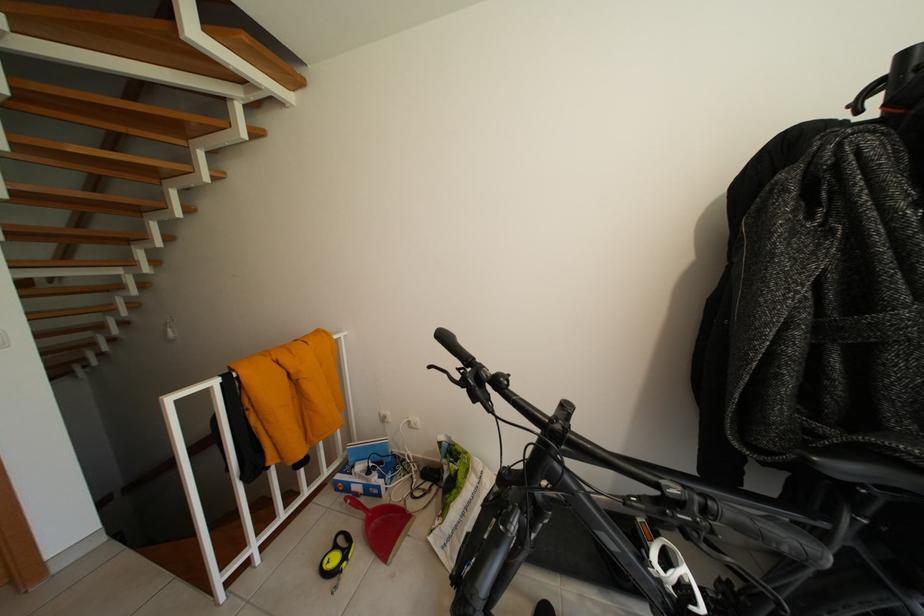
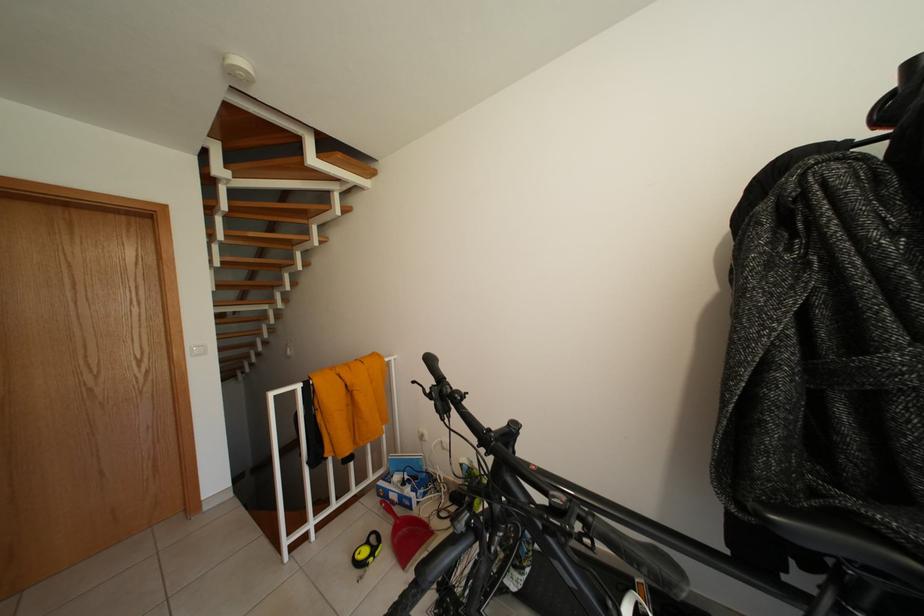
Question: How did the camera likely rotate?

Choices:
 (A) Left
 (B) Right
 (C) Up
 (D) Down

Answer: (A)